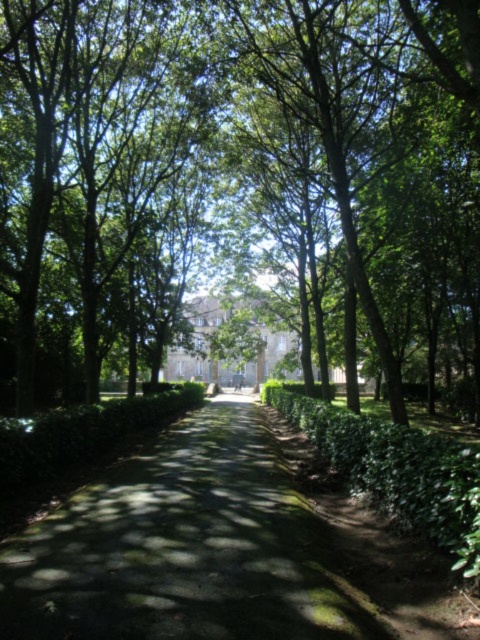
You are standing at the entrance of the pathway and want to walk towards the building in the background. Where is the green mossy path at center located relative to your position?

The green mossy path at center is located at point [219,548], which is ahead of your current position at the entrance, leading towards the building in the background.

You are a gardener who needs to know which object is wider between the green leafy tree at center and the green leafy hedge at center. Which one is wider?

The green leafy tree at center is wider than the green leafy hedge at center according to the description.

Based on the photo, you are standing at the starting point of the pathway and want to walk straight ahead towards the building. Is the green leafy tree at center in your direct path?

The green leafy tree at center is positioned at point (239, 177), which means it is located to the left side of the pathway. Therefore, it is not in your direct path towards the building.